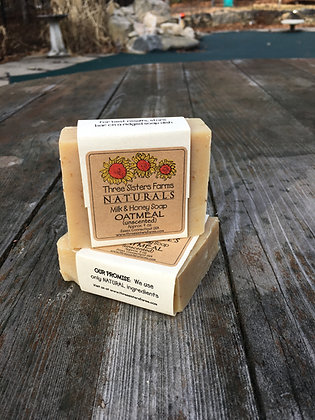
Image resolution: width=315 pixels, height=420 pixels. What are the coordinates of `light` in the screenshot? It's located at (277, 215).